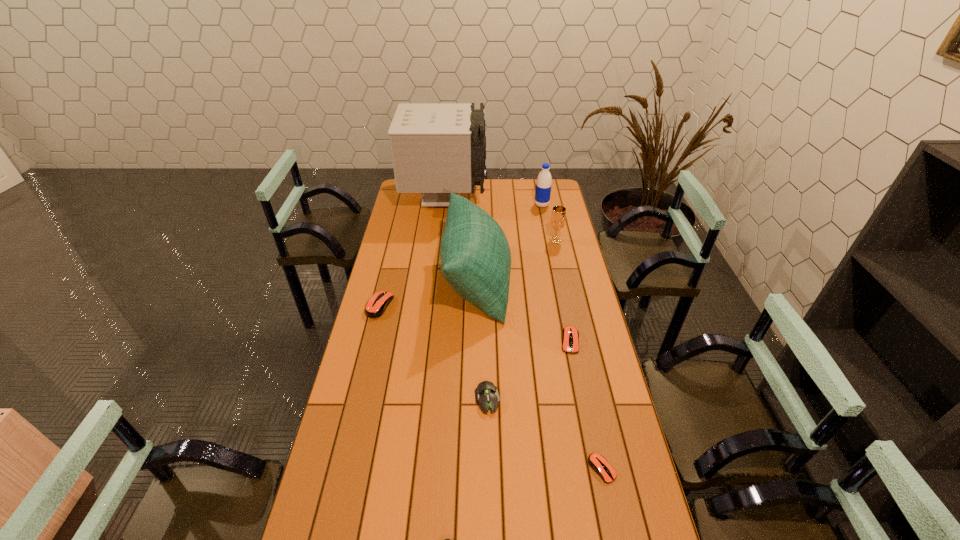
In the image, there is a desktop. Where is `vacant area at the far edge`? The image size is (960, 540). vacant area at the far edge is located at coordinates (478, 198).

The height and width of the screenshot is (540, 960). In the image, there is a desktop. Identify the location of vacant space at the left edge. (351, 391).

Locate an element on the screen. This screenshot has height=540, width=960. free space at the right edge of the desktop is located at coordinates (625, 450).

The width and height of the screenshot is (960, 540). Identify the location of vacant area that lies between the blue water bottle and the tallest object. (493, 201).

I want to click on free spot between the fourth tallest object and the gray fan, so pyautogui.click(x=500, y=219).

This screenshot has height=540, width=960. I want to click on empty location between the farthest computer mouse and the second nearest orange computer mouse, so click(475, 323).

I want to click on free space between the cushion and the seventh shortest object, so click(509, 243).

Locate an element on the screen. Image resolution: width=960 pixels, height=540 pixels. free spot between the third farthest computer mouse and the water bottle is located at coordinates (515, 302).

Where is `vacant space in between the second nearest computer mouse and the cushion`? Image resolution: width=960 pixels, height=540 pixels. vacant space in between the second nearest computer mouse and the cushion is located at coordinates (540, 375).

Locate which object ranks in proximity to the farthest orange computer mouse. Please provide its 2D coordinates. Your answer should be formatted as a tuple, i.e. [(x, y)], where the tuple contains the x and y coordinates of a point satisfying the conditions above.

[(475, 256)]